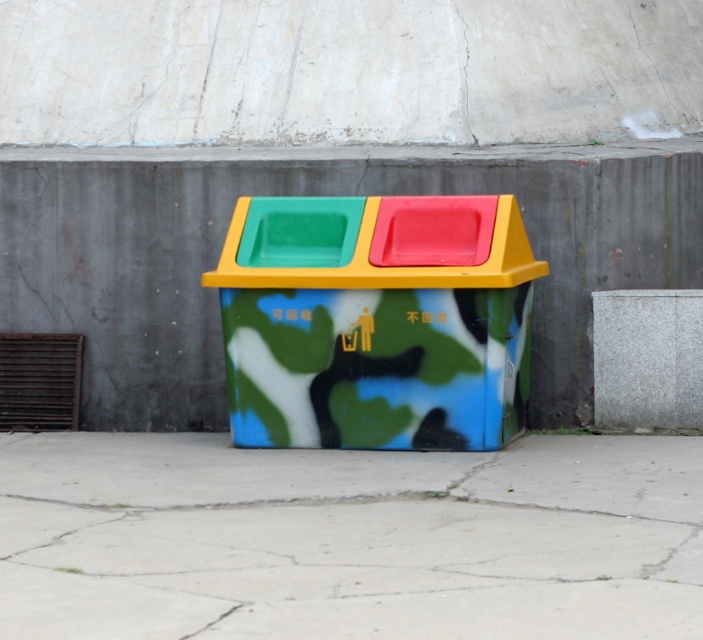
Which is below, concrete at center or gray concrete wall at center?

concrete at center is below.

This screenshot has width=703, height=640. What do you see at coordinates (348, 538) in the screenshot? I see `concrete at center` at bounding box center [348, 538].

Locate an element on the screen. This screenshot has width=703, height=640. concrete at center is located at coordinates (348, 538).

Can you confirm if concrete at center is taller than camouflage paint recycling bin at center?

In fact, concrete at center may be shorter than camouflage paint recycling bin at center.

Does point (652, 628) come behind point (240, 241)?

No.

Which is in front, point (278, 531) or point (520, 371)?

Point (278, 531) is more forward.

Find the location of a particular element. concrete at center is located at coordinates (348, 538).

Does camouflage paint recycling bin at center have a larger size compared to gray concrete wall at center?

Yes.

Can you confirm if camouflage paint recycling bin at center is thinner than gray concrete wall at center?

Incorrect, camouflage paint recycling bin at center's width is not less than gray concrete wall at center's.

Which is in front, point (363, 204) or point (624, 417)?

Point (363, 204) is in front.

At what (x,y) coordinates should I click in order to perform the action: click on camouflage paint recycling bin at center. Please return your answer as a coordinate pair (x, y). This screenshot has width=703, height=640. Looking at the image, I should click on (375, 321).